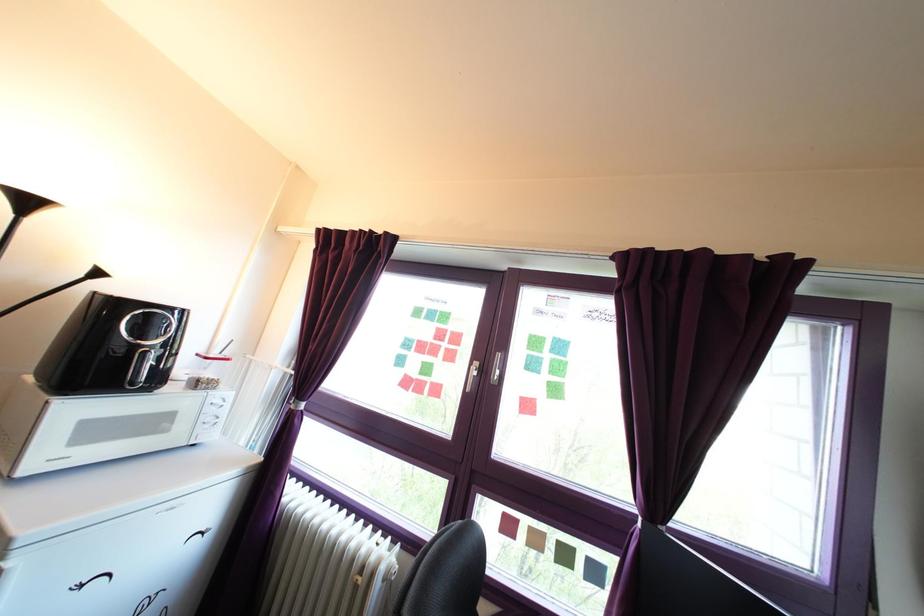
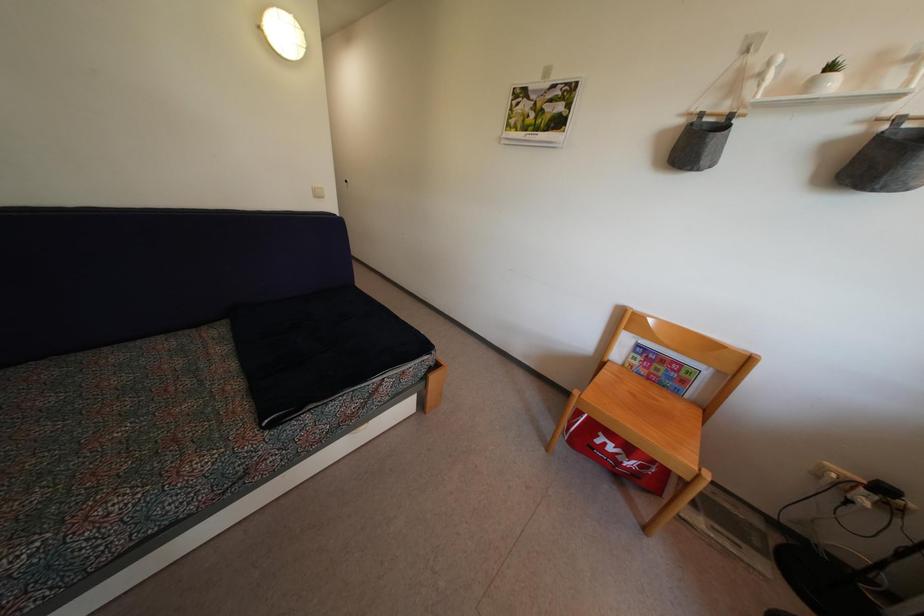
Question: The camera is either moving clockwise (left) or counter-clockwise (right) around the object. The first image is from the beginning of the video and the second image is from the end. Is the camera moving left or right when shooting the video?

Choices:
 (A) Left
 (B) Right

Answer: (B)